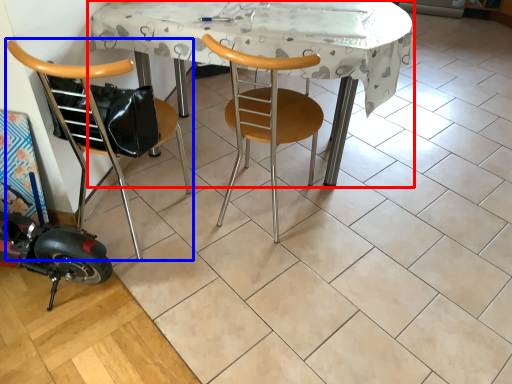
Question: Which object is further to the camera taking this photo, table (highlighted by a red box) or chair (highlighted by a blue box)?

Choices:
 (A) table
 (B) chair

Answer: (A)